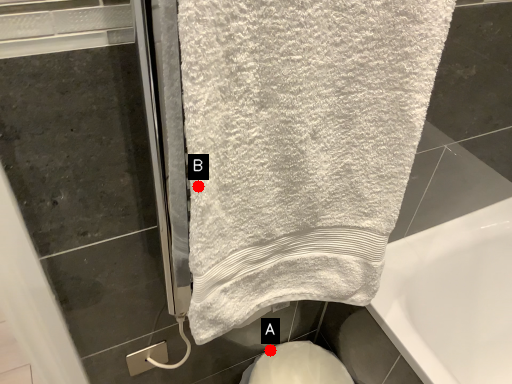
Question: Two points are circled on the image, labeled by A and B beside each circle. Which point is closer to the camera?

Choices:
 (A) A is closer
 (B) B is closer

Answer: (B)